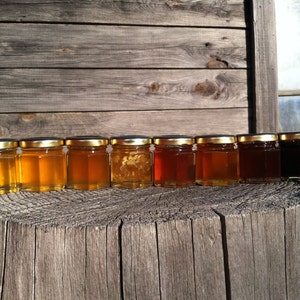
This screenshot has width=300, height=300. Identify the location of jars containing dark substance. (291, 156), (268, 160).